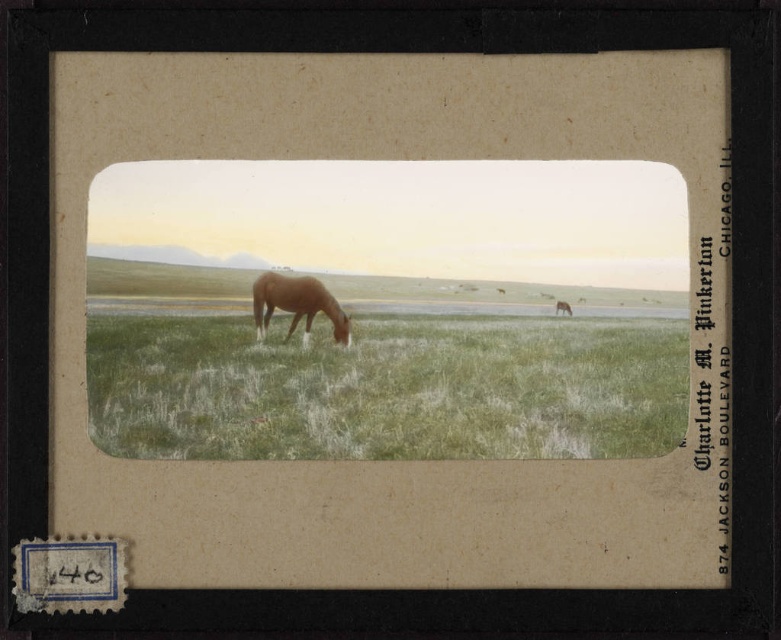
Question: Does light brown horse at center appear under brown matte horse at center?

Choices:
 (A) yes
 (B) no

Answer: (A)

Question: Is green grassy field at center further to the viewer compared to brown matte horse at center?

Choices:
 (A) yes
 (B) no

Answer: (B)

Question: Which object is farther from the camera taking this photo?

Choices:
 (A) brown matte horse at center
 (B) light brown horse at center

Answer: (A)

Question: Which of the following is the farthest from the observer?

Choices:
 (A) (307, 323)
 (B) (204, 372)

Answer: (A)

Question: Which of these objects is positioned closest to the green grassy field at center?

Choices:
 (A) brown matte horse at center
 (B) light brown horse at center

Answer: (B)

Question: Is green grassy field at center to the left of brown matte horse at center from the viewer's perspective?

Choices:
 (A) yes
 (B) no

Answer: (A)